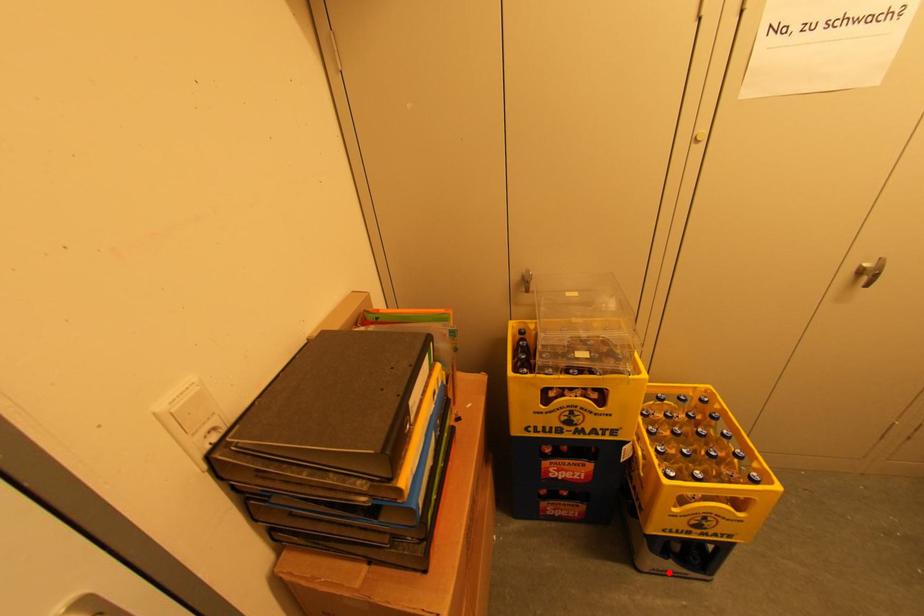
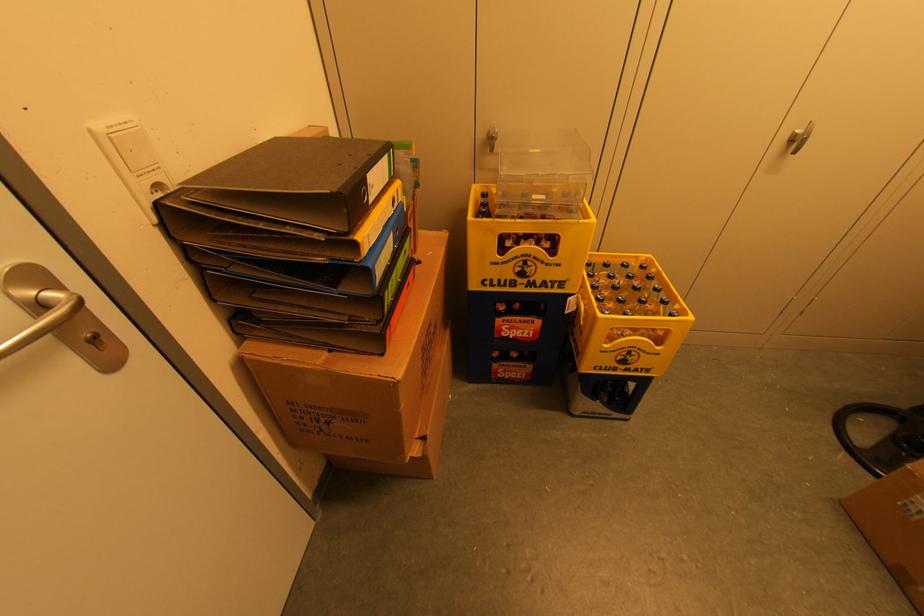
Find the pixel in the second image that matches the highlighted location in the first image.

(598, 413)